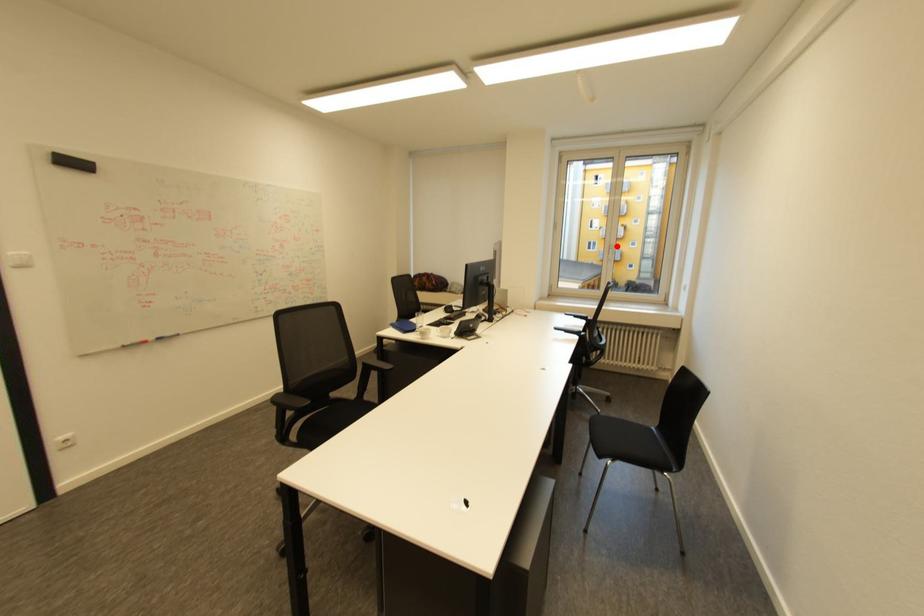
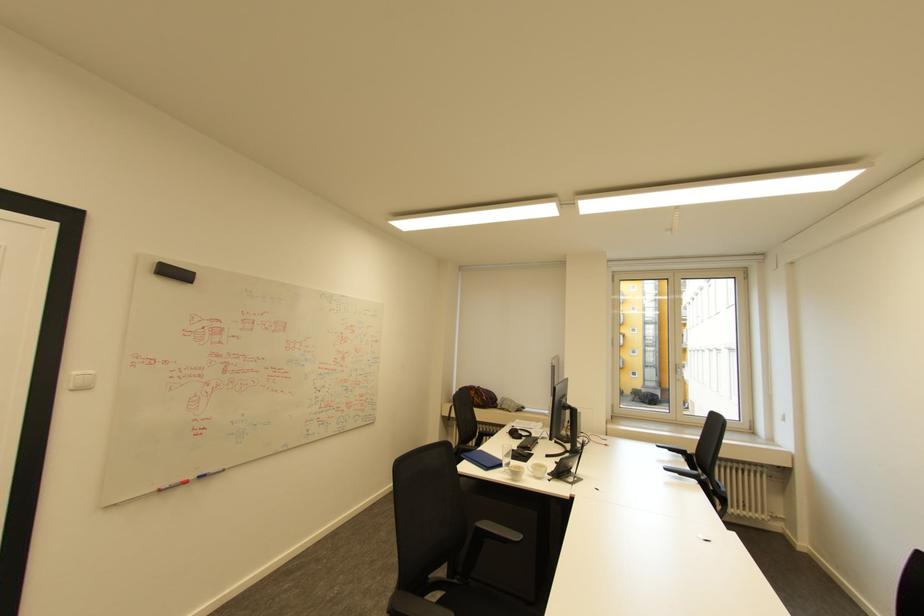
Question: A red point is marked in image1. In image2, is the corresponding 3D point closer to the camera or farther? Reply with the corresponding letter.

Choices:
 (A) The corresponding 3D point is closer.
 (B) The corresponding 3D point is farther.

Answer: (A)